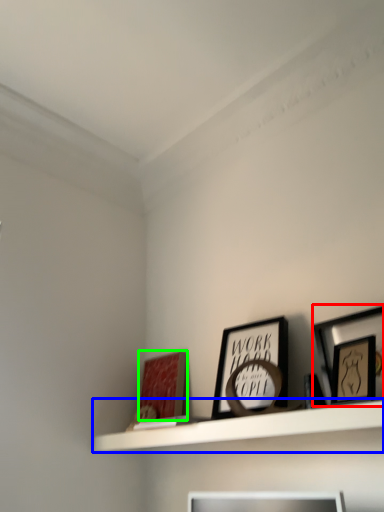
Question: Which is nearer to the picture frame (highlighted by a red box)? shelf (highlighted by a blue box) or picture frame (highlighted by a green box).

Choices:
 (A) shelf
 (B) picture frame

Answer: (A)